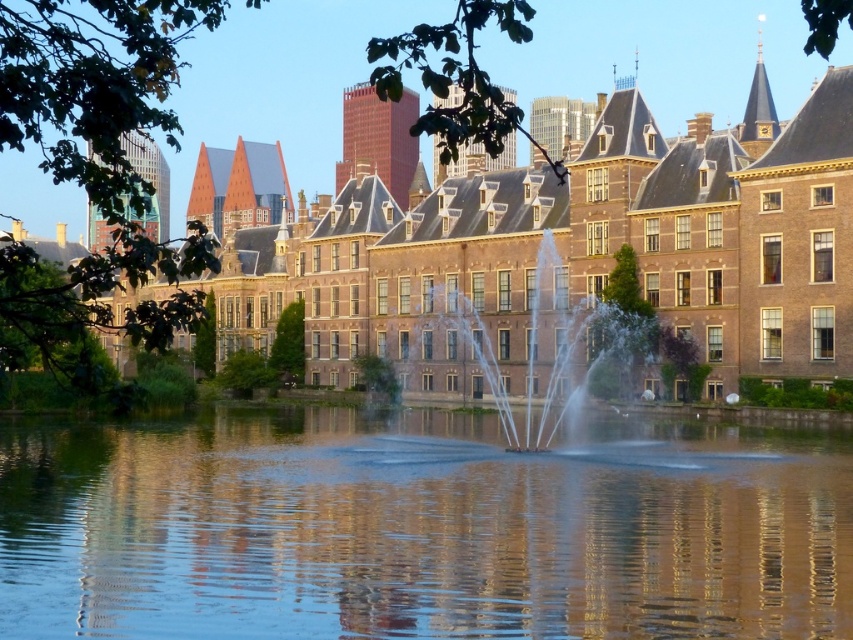
Is point (766, 611) more distant than point (810, 248)?

No.

Is transparent water at center wider than brown brick building at center?

No.

Where is `transparent water at center`? Image resolution: width=853 pixels, height=640 pixels. transparent water at center is located at coordinates (419, 529).

Identify the location of transparent water at center. (419, 529).

Does transparent water at center appear under clear water jets at center?

Correct, transparent water at center is located below clear water jets at center.

Between transparent water at center and clear water jets at center, which one has more height?

With more height is clear water jets at center.

Does point (679, 634) come in front of point (462, 358)?

Yes, it is in front of point (462, 358).

Identify the location of transparent water at center. Image resolution: width=853 pixels, height=640 pixels. (419, 529).

Between brown brick building at center and clear water jets at center, which one has less height?

clear water jets at center is shorter.

Can you confirm if brown brick building at center is bigger than clear water jets at center?

Yes.

Image resolution: width=853 pixels, height=640 pixels. What do you see at coordinates (579, 250) in the screenshot?
I see `brown brick building at center` at bounding box center [579, 250].

At what (x,y) coordinates should I click in order to perform the action: click on brown brick building at center. Please return your answer as a coordinate pair (x, y). The width and height of the screenshot is (853, 640). Looking at the image, I should click on (579, 250).